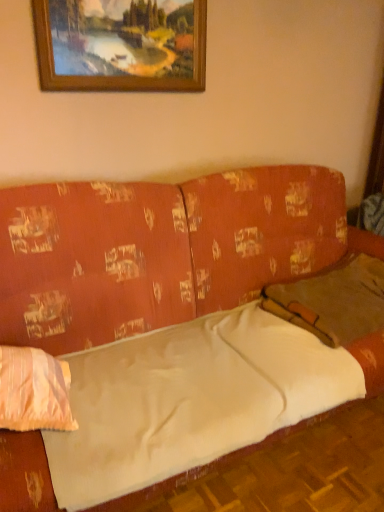
Question: Considering the relative sizes of wooden picture frame at upper center and light pink fabric pillow at left, positioned as the 2th pillow in right-to-left order, in the image provided, is wooden picture frame at upper center thinner than light pink fabric pillow at left, positioned as the 2th pillow in right-to-left order,?

Choices:
 (A) no
 (B) yes

Answer: (B)

Question: Is wooden picture frame at upper center looking in the opposite direction of light pink fabric pillow at left, positioned as the 2th pillow in right-to-left order?

Choices:
 (A) yes
 (B) no

Answer: (B)

Question: From the image's perspective, is wooden picture frame at upper center under light pink fabric pillow at left, the first pillow from the left?

Choices:
 (A) yes
 (B) no

Answer: (B)

Question: Does wooden picture frame at upper center turn towards light pink fabric pillow at left, positioned as the 2th pillow in right-to-left order?

Choices:
 (A) no
 (B) yes

Answer: (A)

Question: From the image's perspective, would you say wooden picture frame at upper center is positioned over light pink fabric pillow at left, positioned as the 2th pillow in right-to-left order?

Choices:
 (A) no
 (B) yes

Answer: (B)

Question: Does wooden picture frame at upper center come behind light pink fabric pillow at left, positioned as the 2th pillow in right-to-left order?

Choices:
 (A) yes
 (B) no

Answer: (A)

Question: Could you tell me if textured orange couch at center is facing brown fabric pillow at right, arranged as the first pillow when viewed from the back?

Choices:
 (A) yes
 (B) no

Answer: (A)

Question: Is textured orange couch at center closer to the viewer compared to brown fabric pillow at right, arranged as the first pillow when viewed from the back?

Choices:
 (A) no
 (B) yes

Answer: (B)

Question: Is textured orange couch at center further to the viewer compared to brown fabric pillow at right, arranged as the 2th pillow when viewed from the front?

Choices:
 (A) no
 (B) yes

Answer: (A)

Question: Can you confirm if textured orange couch at center is wider than brown fabric pillow at right, arranged as the first pillow when viewed from the back?

Choices:
 (A) yes
 (B) no

Answer: (A)

Question: Considering the relative sizes of textured orange couch at center and brown fabric pillow at right, acting as the first pillow starting from the right, in the image provided, is textured orange couch at center thinner than brown fabric pillow at right, acting as the first pillow starting from the right,?

Choices:
 (A) no
 (B) yes

Answer: (A)

Question: From a real-world perspective, is textured orange couch at center on brown fabric pillow at right, the 2th pillow in the left-to-right sequence?

Choices:
 (A) yes
 (B) no

Answer: (B)

Question: Can you confirm if brown fabric pillow at right, arranged as the first pillow when viewed from the back, is thinner than light pink fabric pillow at left, placed as the 1th pillow when sorted from front to back?

Choices:
 (A) yes
 (B) no

Answer: (B)